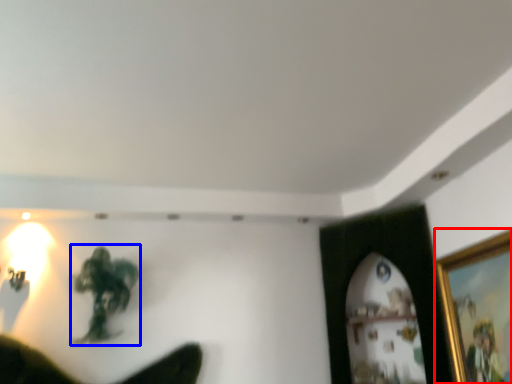
Question: Which object is closer to the camera taking this photo, picture frame (highlighted by a red box) or person (highlighted by a blue box)?

Choices:
 (A) picture frame
 (B) person

Answer: (A)